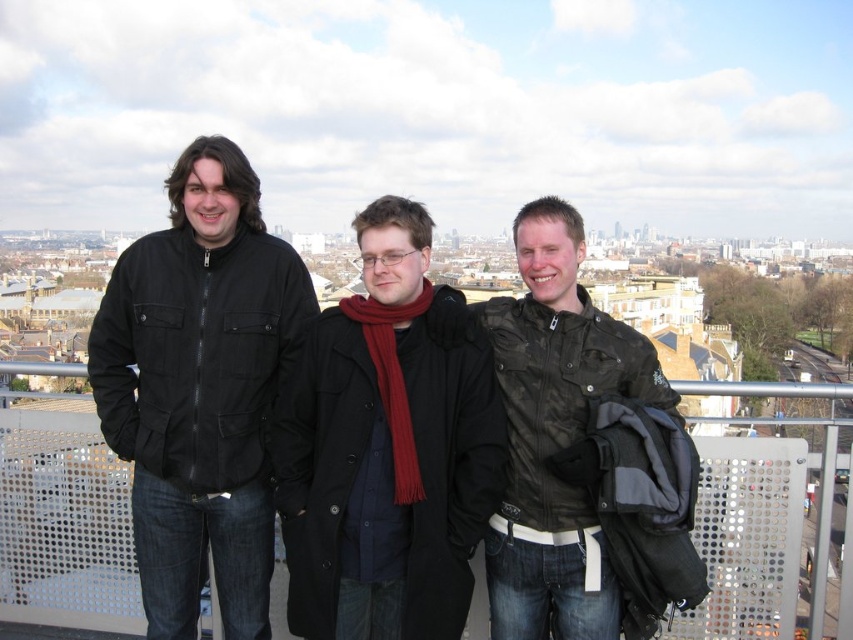
You are a fashion designer observing the three people in the image. You need to determine which jacket is more suitable for a winter collection based on their sizes. Which jacket between the black matte jacket at left and the camouflage jacket at center would you recommend?

The camouflage jacket at center is larger than the black matte jacket at left, making it more suitable for a winter collection as larger jackets typically provide better insulation and coverage against cold weather.

You are a photographer standing on a rooftop with a camera. You want to take a photo of the matte black coat at center and the camouflage jacket at center so that both are clearly visible in the frame. Given that your camera has a maximum focus range of 7 meters, will you be able to capture both subjects in focus?

The matte black coat at center and camouflage jacket at center are 7.40 meters apart from each other. Since the camera can only focus up to 7 meters, the distance between them exceeds the focus range. Therefore, you won that be able to capture both subjects in focus.

You are standing at the center of the rooftop and want to hand a document to the person wearing the matte black coat at center. In which direction should you walk to reach them?

Since the matte black coat at center is located at point coordinates 0.700 on the x axis and 0.455 on the y axis, you should walk towards the direction of the coordinates to reach the person wearing the matte black coat at center.